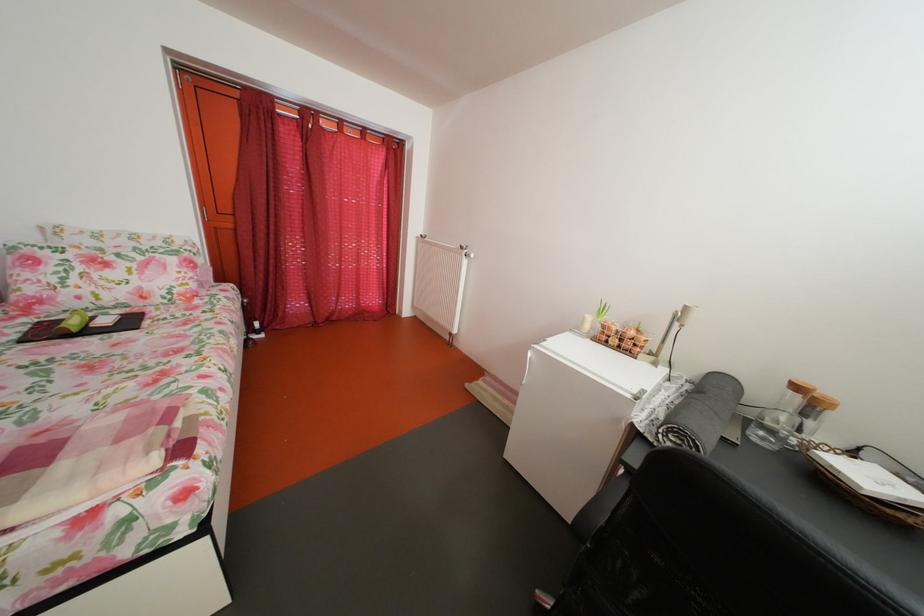
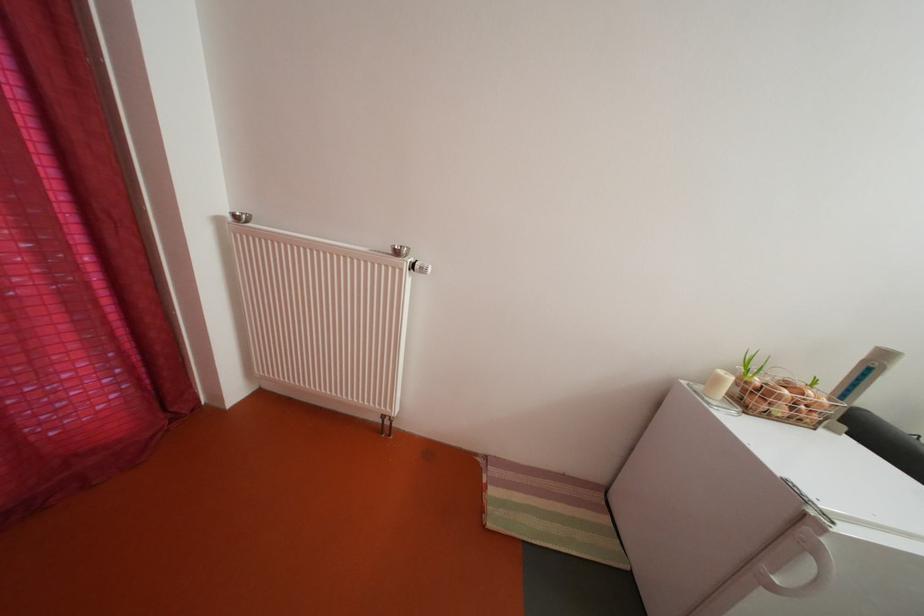
In the second image, find the point that corresponds to point (626, 347) in the first image.

(792, 416)